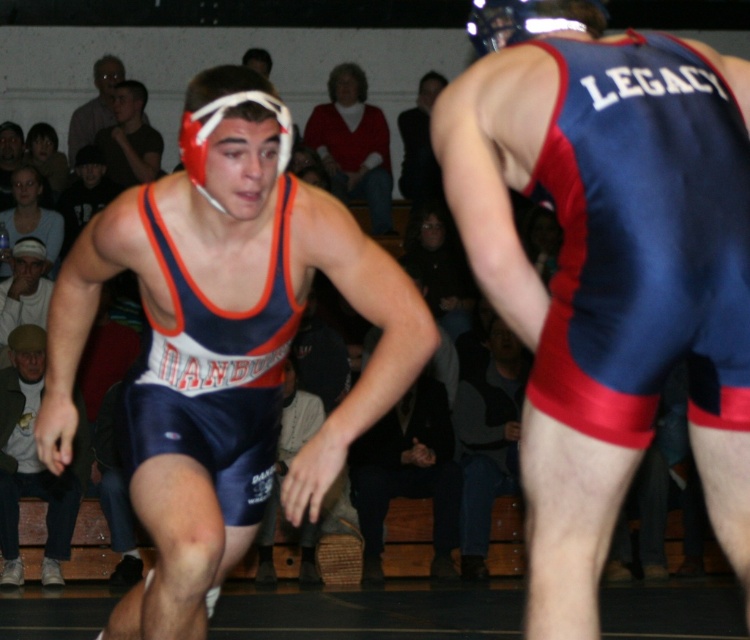
In the scene shown: You are a referee in a wrestling match and need to ensure both wrestlers are wearing singlets that meet the minimum width requirement of 30 cm. You observe the blue satin singlet at center and the matte blue singlet at center. Which singlet might not comply with the regulation?

The blue satin singlet at center has a width less than the matte blue singlet at center, so it might not comply with the regulation.

You are a photographer standing at the edge of the wrestling mat. You need to take a clear photo of the matte blue singlet at center without moving closer. What is the minimum focal length required if your camera has a sensor size of 24mm and the subject is 4.46 meters away?

The minimum focal length required is calculated using the formula focal length equals sensor size divided by subject distance. Plugging in the numbers, 24mm divided by 4.46 meters gives approximately 5.38mm. Therefore, a focal length of at least 5.4mm is needed to capture the matte blue singlet at center clearly from that distance.

You are a referee in a wrestling match and need to ensure that both wrestlers are wearing singlets of appropriate size. You observe the blue satin singlet at center and the matte blue singlet at center. Which singlet is smaller in size?

The blue satin singlet at center has a smaller size compared to the matte blue singlet at center, so the blue satin singlet at center is the smaller one.